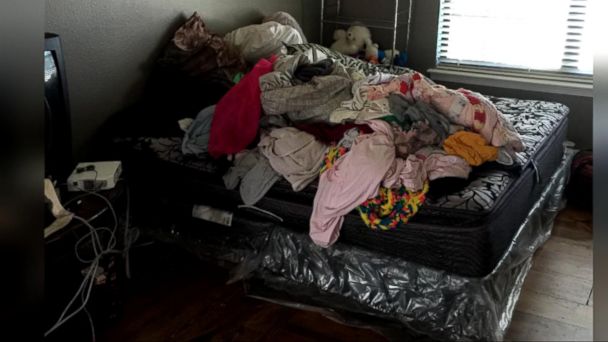
At what (x,y) coordinates should I click in order to perform the action: click on clothes heap on top of bed. Please return your answer as a coordinate pair (x, y). Looking at the image, I should click on (331, 110).